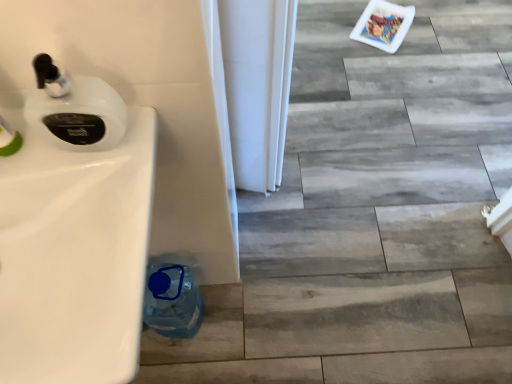
The height and width of the screenshot is (384, 512). What are the coordinates of `vacant space to the right of blue plastic bottle at lower left` in the screenshot? It's located at (241, 321).